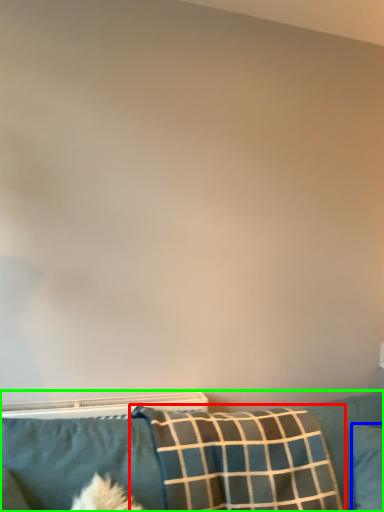
Question: Considering the real-world distances, which object is farthest from pillow (highlighted by a red box)? pillow (highlighted by a blue box) or furniture (highlighted by a green box)?

Choices:
 (A) pillow
 (B) furniture

Answer: (A)